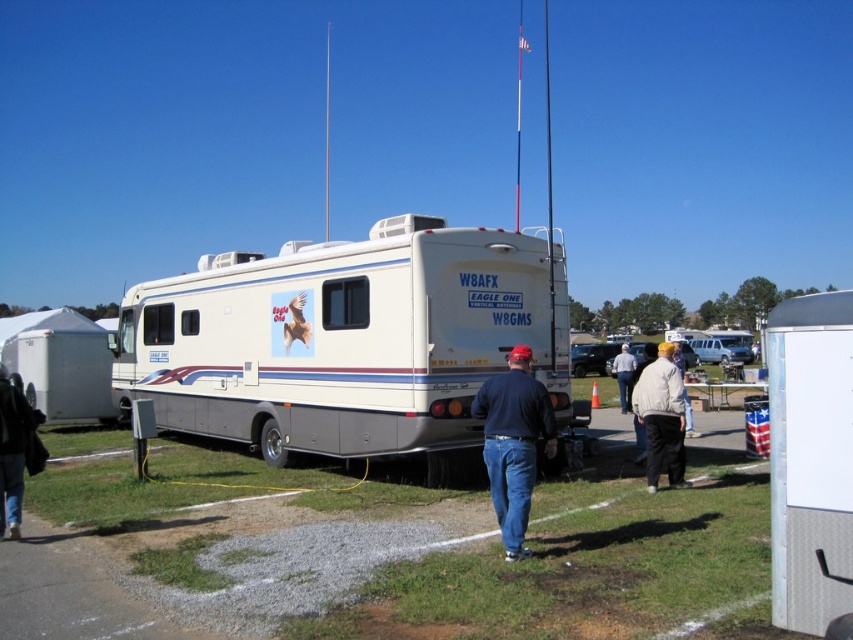
Is light beige jacket at center taller than white cotton shirt at center?

No, light beige jacket at center is not taller than white cotton shirt at center.

Does point (635, 410) come farther from viewer compared to point (625, 392)?

No, (635, 410) is in front of (625, 392).

Who is more distant from viewer, (666, 474) or (619, 353)?

Point (619, 353)

This screenshot has height=640, width=853. I want to click on light beige jacket at center, so click(660, 417).

Which is more to the left, blue denim jeans at center or light beige jacket at center?

Positioned to the left is blue denim jeans at center.

Can you confirm if blue denim jeans at center is taller than light beige jacket at center?

No, blue denim jeans at center is not taller than light beige jacket at center.

Does point (473, 406) come closer to viewer compared to point (665, 392)?

Yes, it is.

Where is `blue denim jeans at center`? This screenshot has height=640, width=853. blue denim jeans at center is located at coordinates (514, 442).

Is point (256, 340) positioned in front of point (10, 490)?

No, it is not.

Between white glossy rv at center and black leather jacket at lower left, which one appears on the right side from the viewer's perspective?

white glossy rv at center is more to the right.

Locate an element on the screen. The width and height of the screenshot is (853, 640). white glossy rv at center is located at coordinates (346, 340).

This screenshot has width=853, height=640. Identify the location of white glossy rv at center. (346, 340).